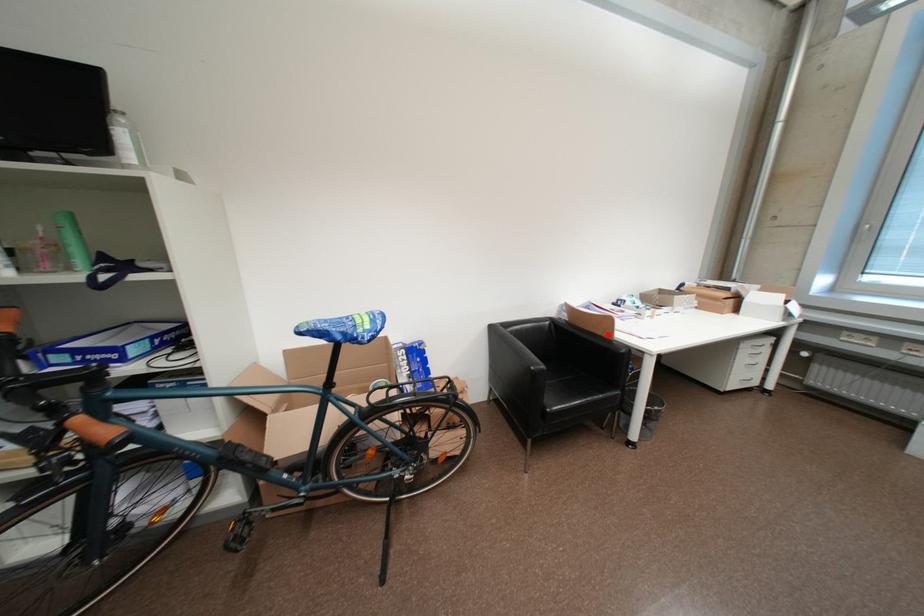
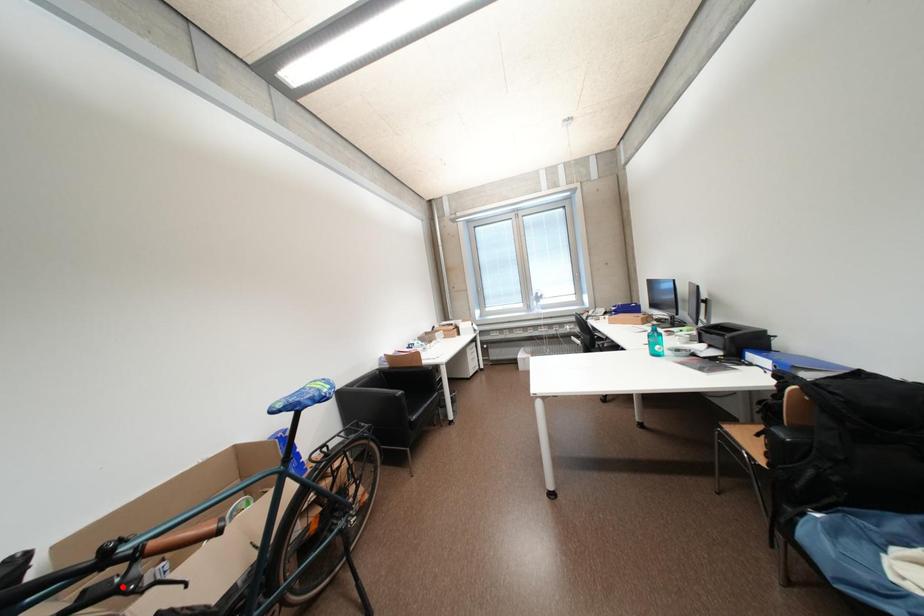
I am providing you with two images of the same scene from different viewpoints. A red point is marked on the first image and another point is marked on the second image. Is the marked point in image1 the same physical position as the marked point in image2?

No